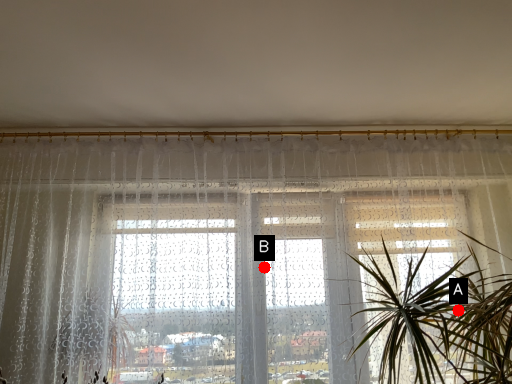
Question: Two points are circled on the image, labeled by A and B beside each circle. Among these points, which one is farthest from the camera?

Choices:
 (A) A is further
 (B) B is further

Answer: (B)